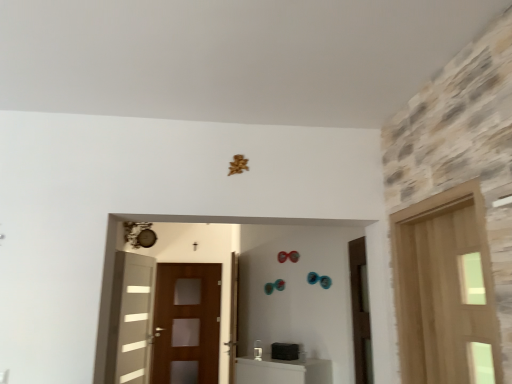
Question: Is brown matte door at right, which is counted as the second door, starting from the right, aimed at brown wooden screen door at center?

Choices:
 (A) no
 (B) yes

Answer: (A)

Question: Is brown matte door at right, the 3th door positioned from the left, thinner than brown wooden screen door at center?

Choices:
 (A) yes
 (B) no

Answer: (B)

Question: Is brown matte door at right, the 3th door positioned from the left, at the left side of brown wooden screen door at center?

Choices:
 (A) no
 (B) yes

Answer: (A)

Question: Does brown matte door at right, the 3th door positioned from the left, touch brown wooden screen door at center?

Choices:
 (A) no
 (B) yes

Answer: (A)

Question: Is brown matte door at right, the 3th door positioned from the left, to the right of brown wooden screen door at center from the viewer's perspective?

Choices:
 (A) no
 (B) yes

Answer: (B)

Question: From their relative heights in the image, would you say brown wooden screen door at center is taller or shorter than light wood door at right, which is counted as the fourth door, starting from the left?

Choices:
 (A) short
 (B) tall

Answer: (B)

Question: Is brown wooden screen door at center to the left or to the right of light wood door at right, which is counted as the first door, starting from the right, in the image?

Choices:
 (A) right
 (B) left

Answer: (B)

Question: Does point (185, 291) appear closer or farther from the camera than point (415, 253)?

Choices:
 (A) closer
 (B) farther

Answer: (B)

Question: From the image's perspective, relative to light wood door at right, which is counted as the first door, starting from the right, is brown wooden screen door at center above or below?

Choices:
 (A) below
 (B) above

Answer: (A)

Question: From a real-world perspective, is white glossy door at left, arranged as the 4th door when viewed from the right, above or below light wood door at right, which is counted as the first door, starting from the right?

Choices:
 (A) below
 (B) above

Answer: (A)

Question: In the image, is white glossy door at left, placed as the first door when sorted from left to right, positioned in front of or behind light wood door at right, marked as the fourth door in a back-to-front arrangement?

Choices:
 (A) front
 (B) behind

Answer: (B)

Question: Considering the positions of white glossy door at left, arranged as the 4th door when viewed from the right, and light wood door at right, which is counted as the fourth door, starting from the left, in the image, is white glossy door at left, arranged as the 4th door when viewed from the right, bigger or smaller than light wood door at right, which is counted as the fourth door, starting from the left,?

Choices:
 (A) big
 (B) small

Answer: (B)

Question: Is point (113, 360) positioned closer to the camera than point (490, 278)?

Choices:
 (A) farther
 (B) closer

Answer: (A)

Question: Considering the positions of brown matte door at right, marked as the 3th door in a back-to-front arrangement, and white glossy door at left, which appears as the first door when viewed from the back, in the image, is brown matte door at right, marked as the 3th door in a back-to-front arrangement, wider or thinner than white glossy door at left, which appears as the first door when viewed from the back,?

Choices:
 (A) wide
 (B) thin

Answer: (A)

Question: Looking at the image, does brown matte door at right, the 3th door positioned from the left, seem bigger or smaller compared to white glossy door at left, arranged as the 4th door when viewed from the right?

Choices:
 (A) big
 (B) small

Answer: (B)